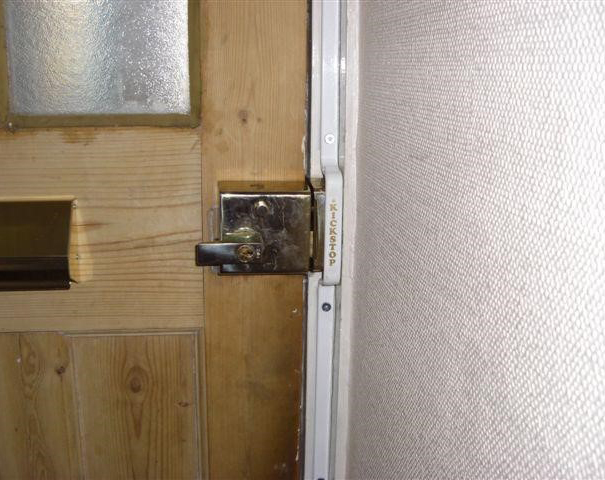
Find the location of a particular element. handle is located at coordinates (233, 244).